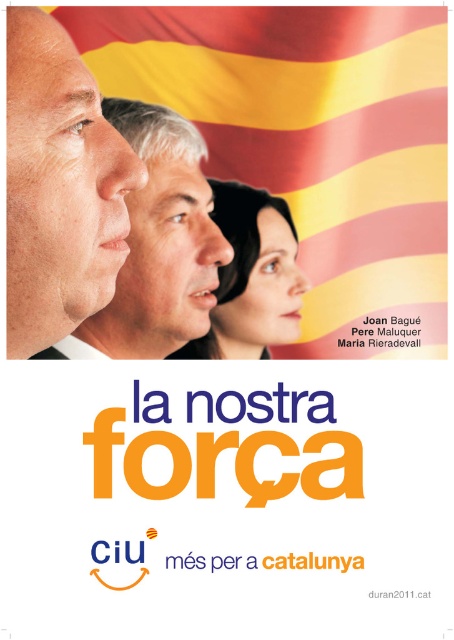
Question: Which of the following is the farthest from the observer?

Choices:
 (A) click(x=284, y=321)
 (B) click(x=133, y=224)
 (C) click(x=14, y=189)

Answer: (A)

Question: Can you confirm if smooth skin face at upper left is wider than smooth skin face at center?

Choices:
 (A) yes
 (B) no

Answer: (B)

Question: Does orange glossy text at upper center lie behind smooth skin face at center?

Choices:
 (A) yes
 (B) no

Answer: (B)

Question: Is orange glossy text at upper center closer to the viewer compared to smooth skin face at upper center?

Choices:
 (A) yes
 (B) no

Answer: (A)

Question: Which of the following is the closest to the observer?

Choices:
 (A) (53, 60)
 (B) (262, 225)

Answer: (A)

Question: Which object is the farthest from the smooth skin face at center?

Choices:
 (A) smooth skin face at upper left
 (B) smooth skin face at upper center

Answer: (A)